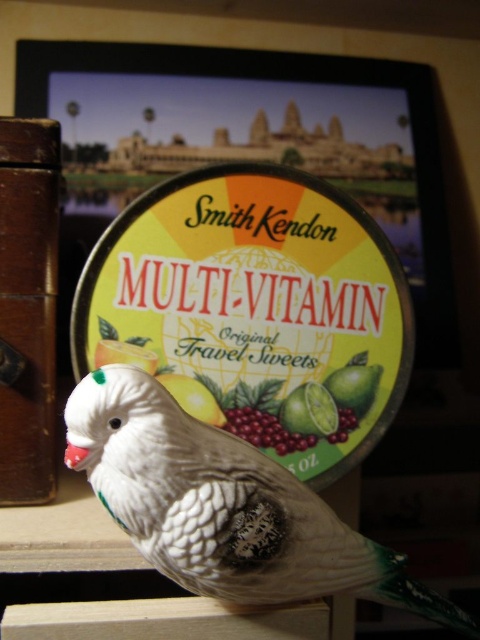
Does green matte lime at center appear over lemon matte/glossy at center?

Incorrect, green matte lime at center is not positioned above lemon matte/glossy at center.

This screenshot has height=640, width=480. I want to click on green matte lime at center, so click(x=310, y=410).

You are a GUI agent. You are given a task and a screenshot of the screen. Output one action in this format:
    pyautogui.click(x=<x>, y=<y>)
    Task: Click on the green matte lime at center
    This screenshot has width=480, height=640.
    Given the screenshot: What is the action you would take?
    tap(310, 410)

Which is in front, point (403, 579) or point (205, 401)?

Positioned in front is point (403, 579).

Who is positioned more to the left, white matte bird at lower left or yellow matte lemon at center?

Positioned to the left is yellow matte lemon at center.

Locate an element on the screen. The image size is (480, 640). white matte bird at lower left is located at coordinates 224,506.

Can you confirm if yellow matte lemon at center is positioned to the left of lemon matte/glossy at center?

No, yellow matte lemon at center is not to the left of lemon matte/glossy at center.

Between point (193, 417) and point (96, 355), which one is positioned behind?

The point (96, 355) is behind.

The height and width of the screenshot is (640, 480). What are the coordinates of `yellow matte lemon at center` in the screenshot? It's located at (192, 397).